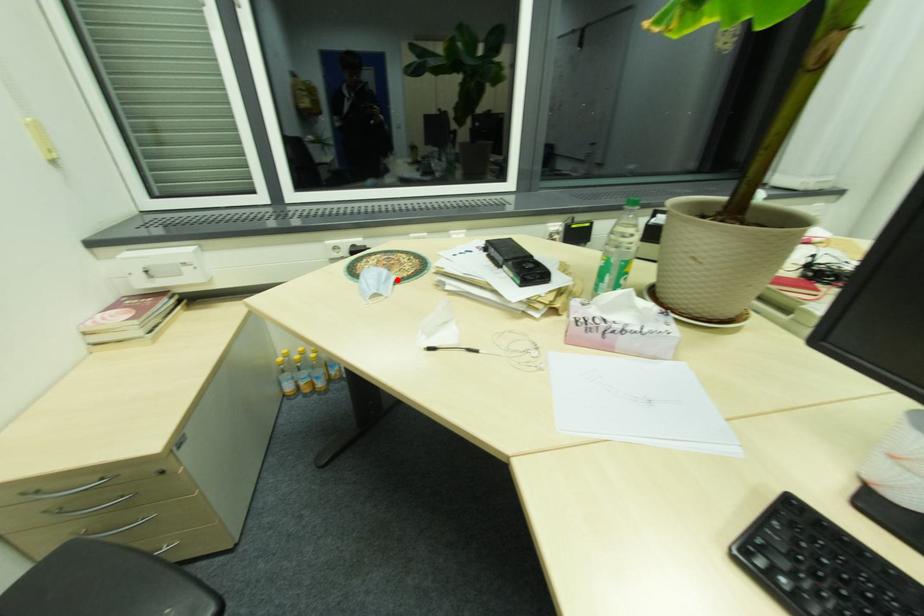
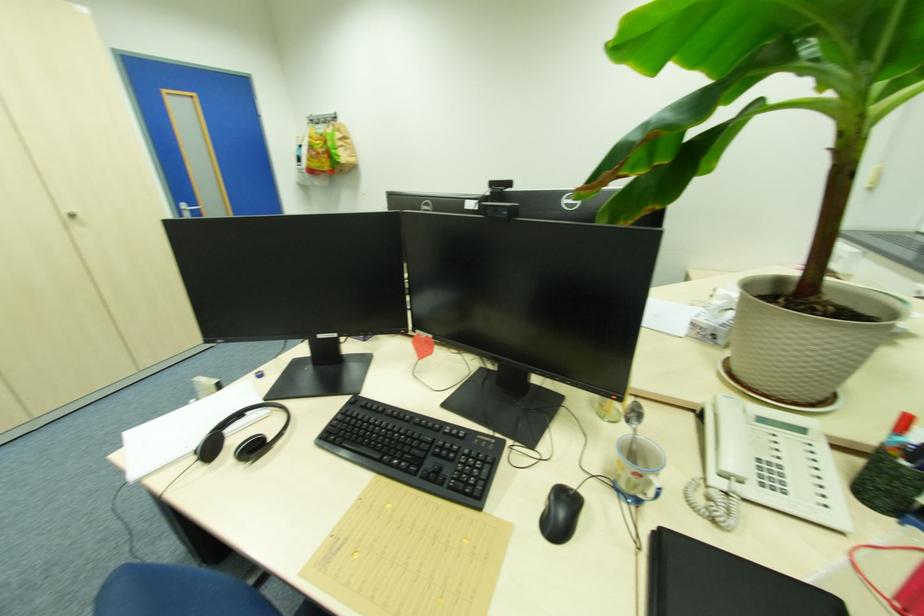
Question: I am providing you with two images of the same scene from different viewpoints. A red point is marked on the first image. Can you still see the location of the red point in image 2?

Choices:
 (A) Yes
 (B) No

Answer: (B)